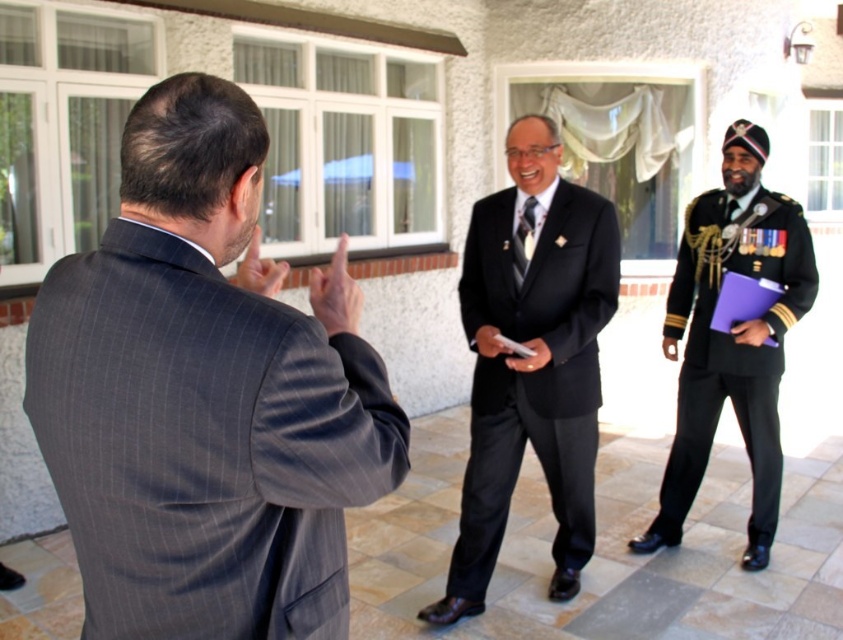
What is the color of the suit worn by the person standing at point (530, 358)?

The color of the suit worn by the person standing at point (530, 358) is black.